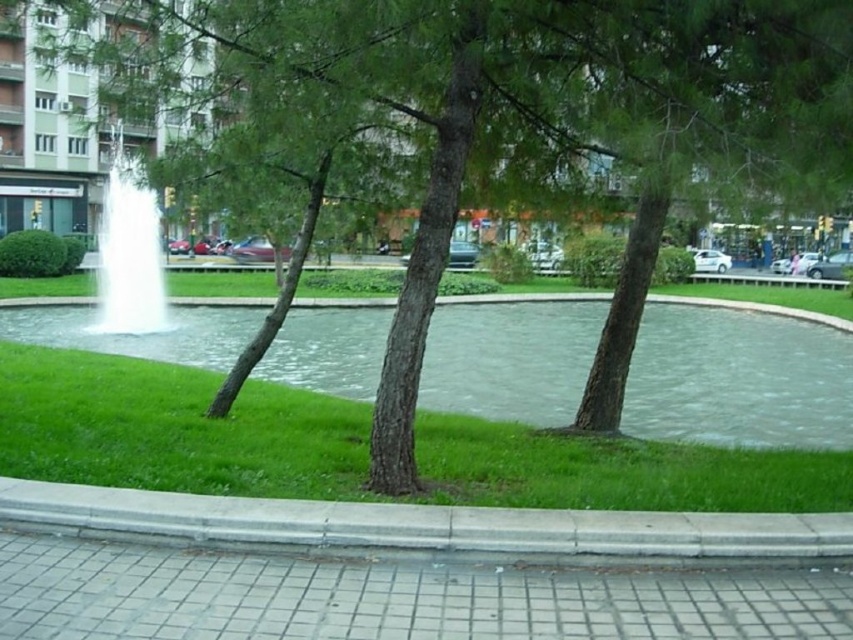
You are a gardener who needs to water the green grass at center and the gray concrete curb at lower center. If your watering can has a range of 10 feet, can you water both areas from your current position without moving?

The green grass at center is 9.98 feet from the gray concrete curb at lower center. Since the distance between them is within the watering can range of 10 feet, you can water both areas from your current position without moving.

You are a maintenance worker needing to reach the white frothy water at center from the gray concrete sidewalk at lower left. Can you walk directly to it without crossing any obstacles?

The gray concrete sidewalk at lower left and white frothy water at center are 14.93 meters apart. Since there are no obstacles mentioned in the scene description between them, you can walk directly to it.

You are standing at the bottom left corner of the image. You want to walk directly towards the green grass at center. In which direction should you move?

Since the green grass at center is located at coordinates approximately 0.670 on the x axis and 0.204 on the y axis, you should move towards the upper right direction from your current position at the bottom left corner.